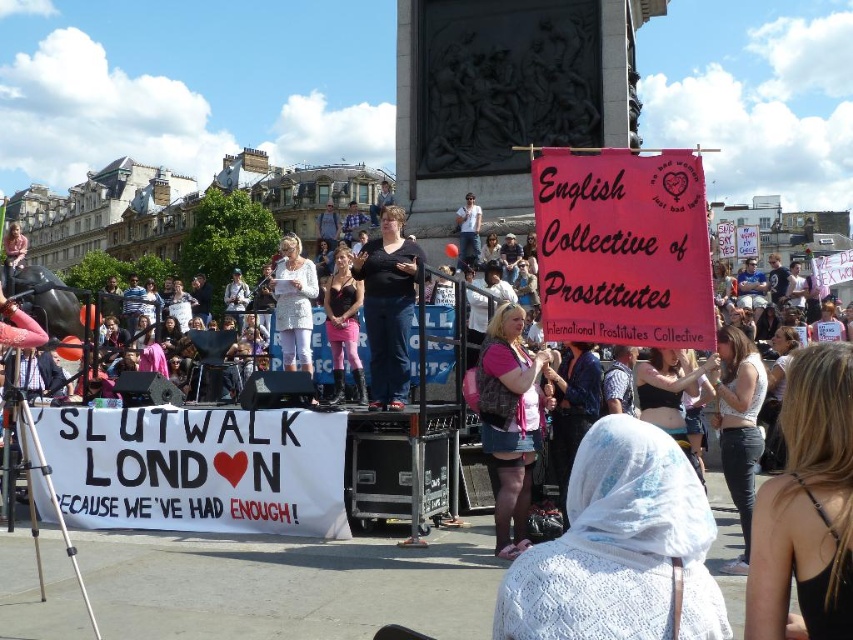
You are a photographer at the demonstration and want to capture both the pink fabric top at center and the pink fabric pants at center in the same frame. Which object should you position closer to the left side of your camera viewfinder to ensure both are visible?

To include both the pink fabric top at center and the pink fabric pants at center in the frame, position the pink fabric pants at center closer to the left side of the viewfinder since the pink fabric top at center is to the right of it.

You are a photographer at the event and want to ensure both the pink fabric top at center and the white lace top at center are clearly visible in your photo. Given their sizes, which top should you focus on first to ensure it doesn

The pink fabric top at center is taller than the white lace top at center, so you should focus on the pink fabric top at center first to ensure it is fully captured in the photo.

You are a photographer at the demonstration and want to capture both the black fabric at center and the pink fabric pants at center in the same frame. Which fabric should you position closer to the left side of your camera to ensure both are visible?

The black fabric at center is positioned on the right side of pink fabric pants at center. To include both in the frame, position the pink fabric pants at center closer to the left side so the black fabric at center naturally falls to the right.